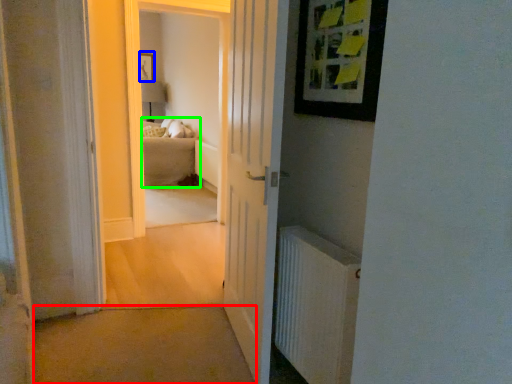
Question: Considering the real-world distances, which object is farthest from path (highlighted by a red box)? picture frame (highlighted by a blue box) or couch (highlighted by a green box)?

Choices:
 (A) picture frame
 (B) couch

Answer: (A)